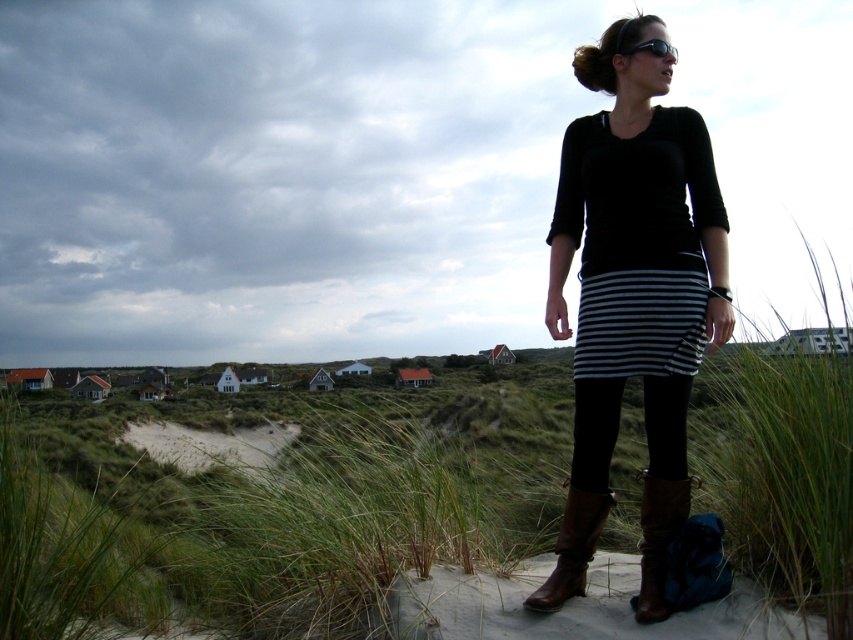
Measure the distance between black striped dress at center and camera.

A distance of 4.14 meters exists between black striped dress at center and camera.

Is black striped dress at center positioned behind brown leather boot at lower center?

Yes, it is.

The image size is (853, 640). In order to click on black striped dress at center in this screenshot , I will do `click(633, 296)`.

Is black striped dress at center further to the viewer compared to brown leather boot at lower right?

Yes, black striped dress at center is further from the viewer.

Is black striped dress at center to the left of brown leather boot at lower right from the viewer's perspective?

Incorrect, black striped dress at center is not on the left side of brown leather boot at lower right.

Is point (718, 339) positioned before point (631, 604)?

No, it is not.

At what (x,y) coordinates should I click in order to perform the action: click on black striped dress at center. Please return your answer as a coordinate pair (x, y). Looking at the image, I should click on (633, 296).

Between brown leather boot at lower center and black plastic goggles at upper center, which one appears on the right side from the viewer's perspective?

black plastic goggles at upper center is more to the right.

Between brown leather boot at lower center and black plastic goggles at upper center, which one is positioned higher?

Positioned higher is black plastic goggles at upper center.

Which is in front, point (543, 584) or point (616, 44)?

Point (543, 584) is in front.

At what (x,y) coordinates should I click in order to perform the action: click on brown leather boot at lower center. Please return your answer as a coordinate pair (x, y). Looking at the image, I should click on (572, 548).